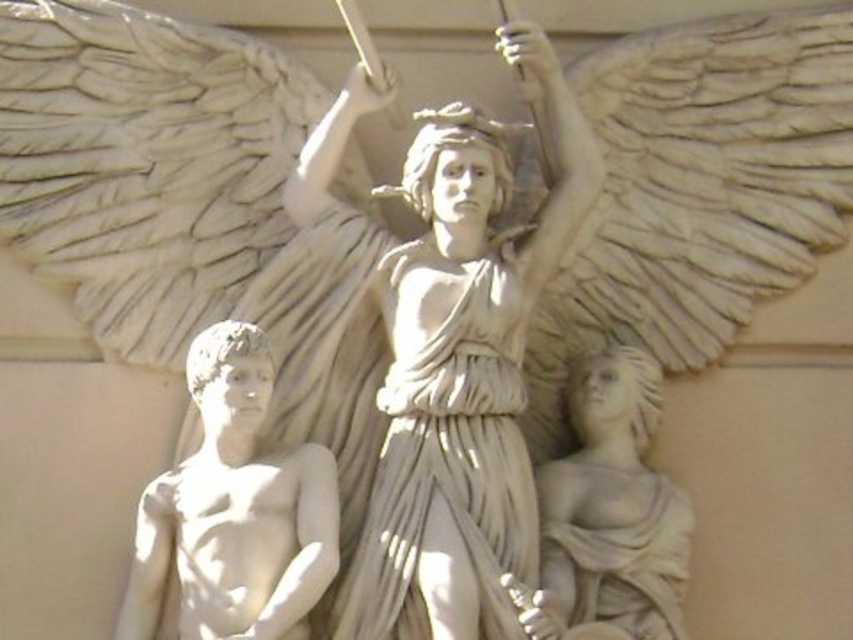
Question: Estimate the real-world distances between objects in this image. Which object is farther from the white marble statue at center?

Choices:
 (A) white marble statue at lower left
 (B) white marble statue at lower right

Answer: (A)

Question: Which object is positioned closest to the white marble statue at lower left?

Choices:
 (A) white marble statue at lower right
 (B) white marble statue at center

Answer: (B)

Question: Can you confirm if white marble statue at center is bigger than white marble statue at lower right?

Choices:
 (A) no
 (B) yes

Answer: (B)

Question: Which object is positioned farthest from the white marble statue at center?

Choices:
 (A) white marble statue at lower left
 (B) white marble statue at lower right

Answer: (A)

Question: Is white marble statue at center thinner than white marble statue at lower right?

Choices:
 (A) no
 (B) yes

Answer: (A)

Question: Does white marble statue at lower left appear on the right side of white marble statue at lower right?

Choices:
 (A) no
 (B) yes

Answer: (A)